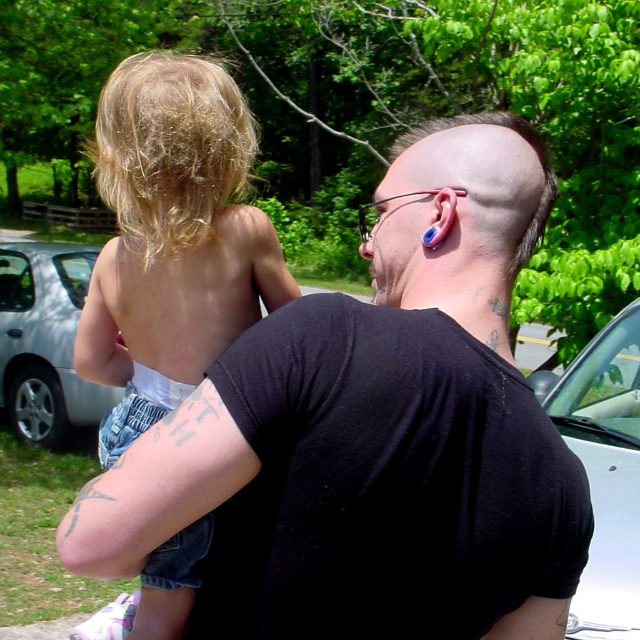
Between black matte shirt at center and silver metallic car at left, which one appears on the left side from the viewer's perspective?

silver metallic car at left is more to the left.

Can you confirm if black matte shirt at center is bigger than silver metallic car at left?

No.

Find the location of `black matte shirt at center`. black matte shirt at center is located at coordinates (372, 435).

Does point (186, 376) come in front of point (22, 429)?

That is True.

Does point (192, 289) come farther from viewer compared to point (17, 404)?

No, it is in front of (17, 404).

Is point (237, 189) behind point (90, 392)?

No.

Image resolution: width=640 pixels, height=640 pixels. In order to click on blonde hair at upper left in this screenshot , I will do `click(172, 237)`.

Is the position of black matte shirt at center more distant than that of white glossy car at right?

That is False.

Can you confirm if black matte shirt at center is bigger than white glossy car at right?

Actually, black matte shirt at center might be smaller than white glossy car at right.

Which is behind, point (337, 496) or point (596, 522)?

The point (596, 522) is more distant.

Locate an element on the screen. This screenshot has height=640, width=640. black matte shirt at center is located at coordinates coord(372,435).